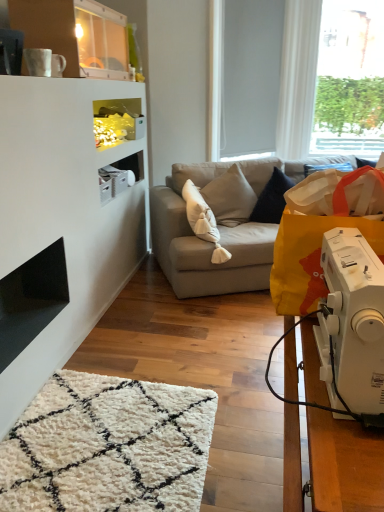
Question: Is white plastic sewing machine at lower right at the right side of beige fabric pillow at center?

Choices:
 (A) no
 (B) yes

Answer: (B)

Question: Would you say white plastic sewing machine at lower right contains beige fabric pillow at center?

Choices:
 (A) no
 (B) yes

Answer: (A)

Question: Is white plastic sewing machine at lower right behind beige fabric pillow at center?

Choices:
 (A) yes
 (B) no

Answer: (B)

Question: Does white plastic sewing machine at lower right come in front of beige fabric pillow at center?

Choices:
 (A) no
 (B) yes

Answer: (B)

Question: Are white plastic sewing machine at lower right and beige fabric pillow at center making contact?

Choices:
 (A) yes
 (B) no

Answer: (B)

Question: From the image's perspective, relative to transparent glass window at upper right, is beige fabric pillow at center above or below?

Choices:
 (A) above
 (B) below

Answer: (B)

Question: Based on their sizes in the image, would you say beige fabric pillow at center is bigger or smaller than transparent glass window at upper right?

Choices:
 (A) small
 (B) big

Answer: (A)

Question: Does point (206, 228) appear closer or farther from the camera than point (337, 35)?

Choices:
 (A) closer
 (B) farther

Answer: (A)

Question: In terms of height, does beige fabric pillow at center look taller or shorter compared to transparent glass window at upper right?

Choices:
 (A) tall
 (B) short

Answer: (B)

Question: Is point (347, 64) closer or farther from the camera than point (352, 265)?

Choices:
 (A) farther
 (B) closer

Answer: (A)

Question: Visually, is transparent glass window at upper right positioned to the left or to the right of white plastic sewing machine at lower right?

Choices:
 (A) right
 (B) left

Answer: (A)

Question: Considering the positions of transparent glass window at upper right and white plastic sewing machine at lower right in the image, is transparent glass window at upper right wider or thinner than white plastic sewing machine at lower right?

Choices:
 (A) wide
 (B) thin

Answer: (A)

Question: From the image's perspective, is transparent glass window at upper right above or below white plastic sewing machine at lower right?

Choices:
 (A) above
 (B) below

Answer: (A)

Question: Considering the positions of light gray fabric couch at center and white plastic sewing machine at lower right in the image, is light gray fabric couch at center bigger or smaller than white plastic sewing machine at lower right?

Choices:
 (A) small
 (B) big

Answer: (B)

Question: Choose the correct answer: Is light gray fabric couch at center inside white plastic sewing machine at lower right or outside it?

Choices:
 (A) outside
 (B) inside

Answer: (A)